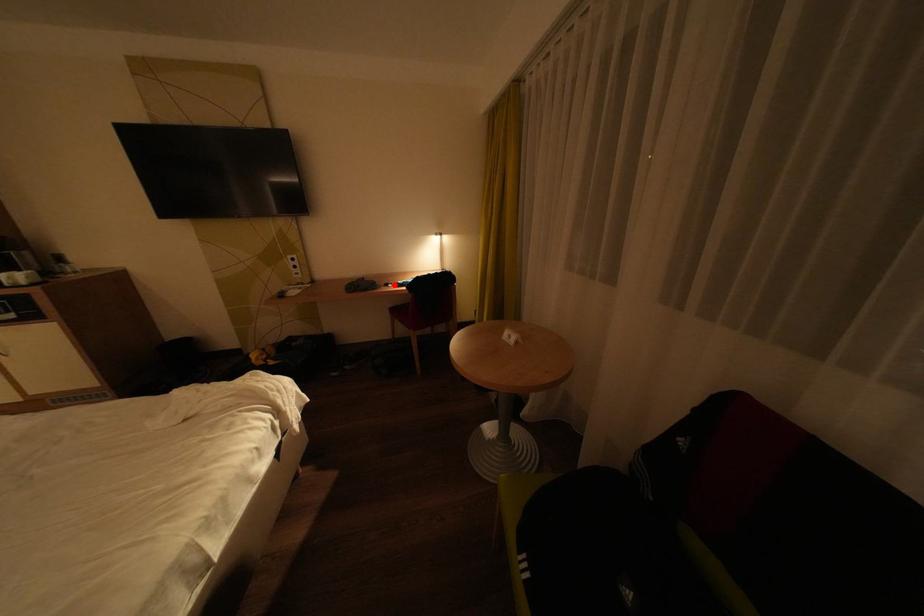
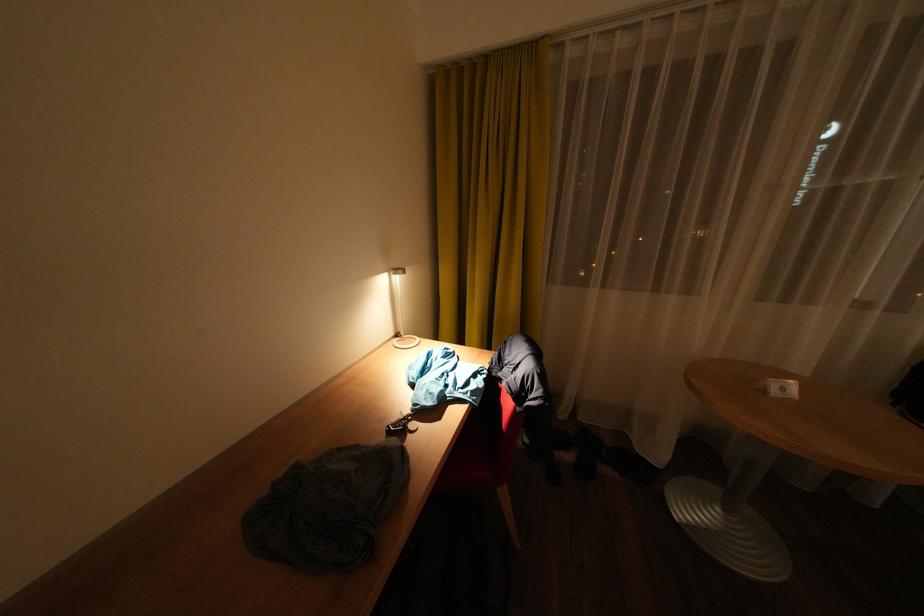
The point at the highlighted location is marked in the first image. Where is the corresponding point in the second image?

(395, 436)